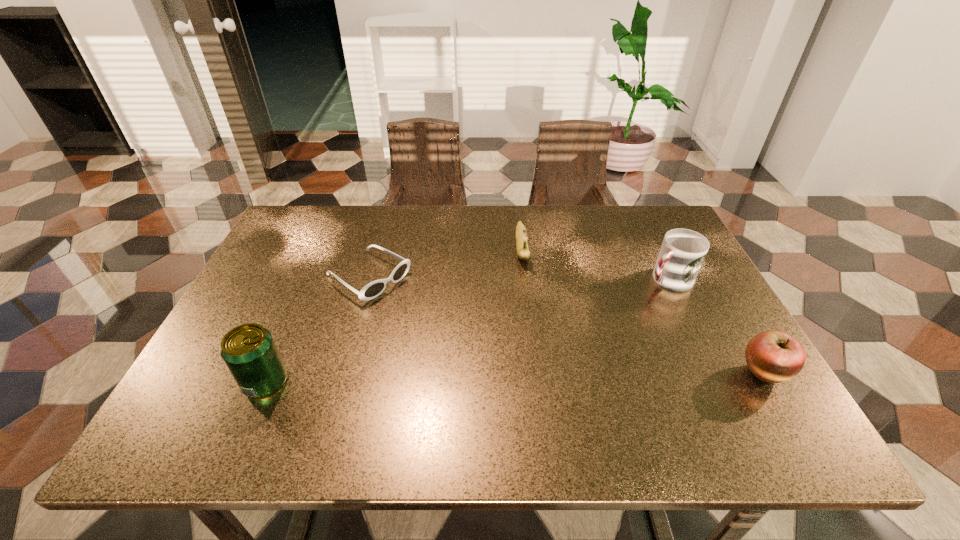
This screenshot has width=960, height=540. I want to click on object that is the closest to the cup, so click(x=773, y=356).

Locate which object ranks fourth in proximity to the beer can. Please provide its 2D coordinates. Your answer should be formatted as a tuple, i.e. [(x, y)], where the tuple contains the x and y coordinates of a point satisfying the conditions above.

[(773, 356)]